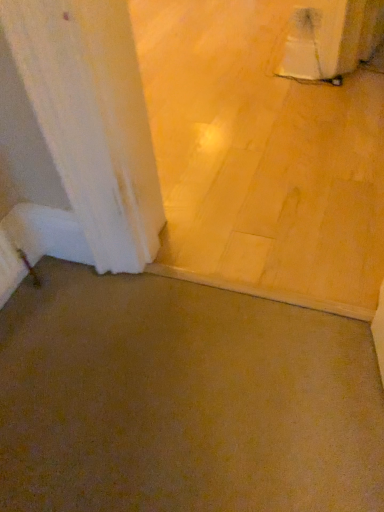
Question: From the image's perspective, is brown matte concrete at lower left, marked as the second concrete in a front-to-back arrangement, on brown matte concrete at center, which ranks as the 2th concrete in top-to-bottom order?

Choices:
 (A) no
 (B) yes

Answer: (B)

Question: Is brown matte concrete at lower left, positioned as the 1th concrete in back-to-front order, facing away from brown matte concrete at center, which ranks as the 2th concrete in top-to-bottom order?

Choices:
 (A) no
 (B) yes

Answer: (A)

Question: Considering the relative sizes of brown matte concrete at lower left, marked as the second concrete in a front-to-back arrangement, and brown matte concrete at center, placed as the 2th concrete when sorted from back to front, in the image provided, is brown matte concrete at lower left, marked as the second concrete in a front-to-back arrangement, bigger than brown matte concrete at center, placed as the 2th concrete when sorted from back to front,?

Choices:
 (A) no
 (B) yes

Answer: (B)

Question: Is brown matte concrete at center, the 1th concrete from the front, a part of brown matte concrete at lower left, marked as the second concrete in a front-to-back arrangement?

Choices:
 (A) no
 (B) yes

Answer: (A)

Question: Can you confirm if brown matte concrete at lower left, positioned as the 1th concrete in back-to-front order, is wider than brown matte concrete at center, the 1th concrete from the front?

Choices:
 (A) yes
 (B) no

Answer: (A)

Question: Does brown matte concrete at lower left, marked as the second concrete in a front-to-back arrangement, have a lesser width compared to brown matte concrete at center, the 1th concrete from the front?

Choices:
 (A) no
 (B) yes

Answer: (A)

Question: From the image's perspective, is brown matte concrete at center, the 1th concrete from the front, located above brown matte concrete at lower left, marked as the second concrete in a front-to-back arrangement?

Choices:
 (A) yes
 (B) no

Answer: (B)

Question: Is brown matte concrete at center, positioned as the first concrete in bottom-to-top order, not within brown matte concrete at lower left, which appears as the 1th concrete when viewed from the top?

Choices:
 (A) no
 (B) yes

Answer: (B)

Question: Can you confirm if brown matte concrete at center, placed as the 2th concrete when sorted from back to front, is positioned to the right of brown matte concrete at lower left, positioned as the 2th concrete in bottom-to-top order?

Choices:
 (A) yes
 (B) no

Answer: (B)

Question: From a real-world perspective, is brown matte concrete at center, the 1th concrete from the front, located beneath brown matte concrete at lower left, positioned as the 1th concrete in back-to-front order?

Choices:
 (A) no
 (B) yes

Answer: (B)

Question: Can you confirm if brown matte concrete at center, which ranks as the 2th concrete in top-to-bottom order, is shorter than brown matte concrete at lower left, positioned as the 1th concrete in back-to-front order?

Choices:
 (A) yes
 (B) no

Answer: (B)

Question: Can you confirm if brown matte concrete at center, the 1th concrete from the front, is wider than brown matte concrete at lower left, which appears as the 1th concrete when viewed from the top?

Choices:
 (A) no
 (B) yes

Answer: (A)

Question: Is brown matte concrete at lower left, positioned as the 1th concrete in back-to-front order, bigger or smaller than brown matte concrete at center, which ranks as the 2th concrete in top-to-bottom order?

Choices:
 (A) small
 (B) big

Answer: (B)